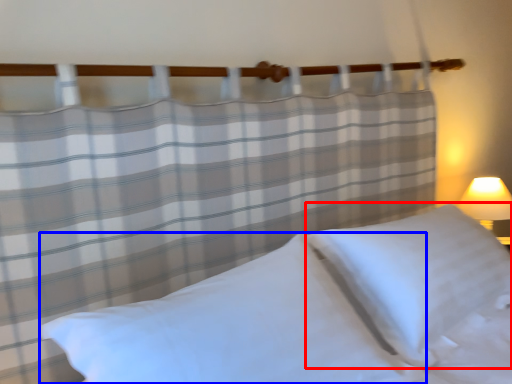
Question: Which point is further to the camera, pillow (highlighted by a red box) or pillow (highlighted by a blue box)?

Choices:
 (A) pillow
 (B) pillow

Answer: (A)